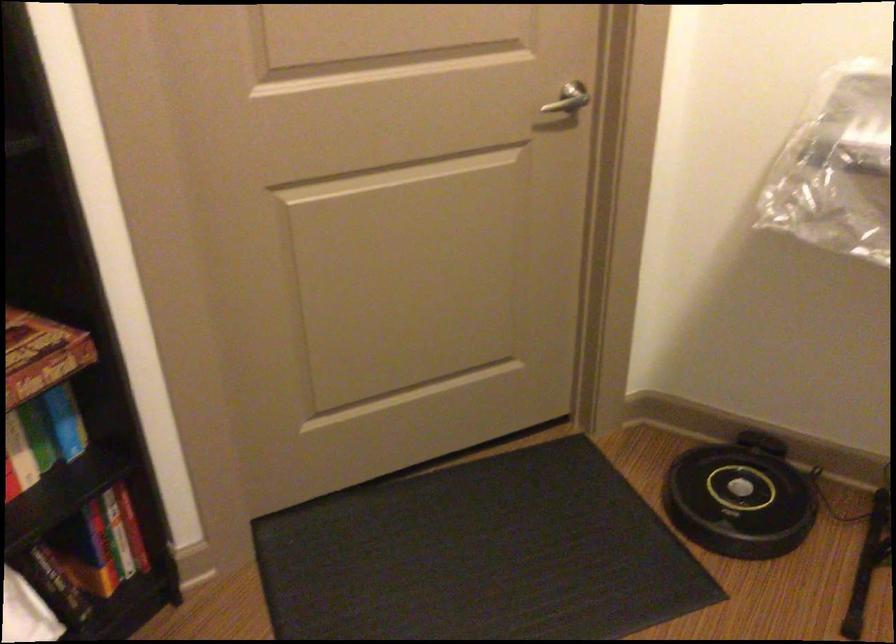
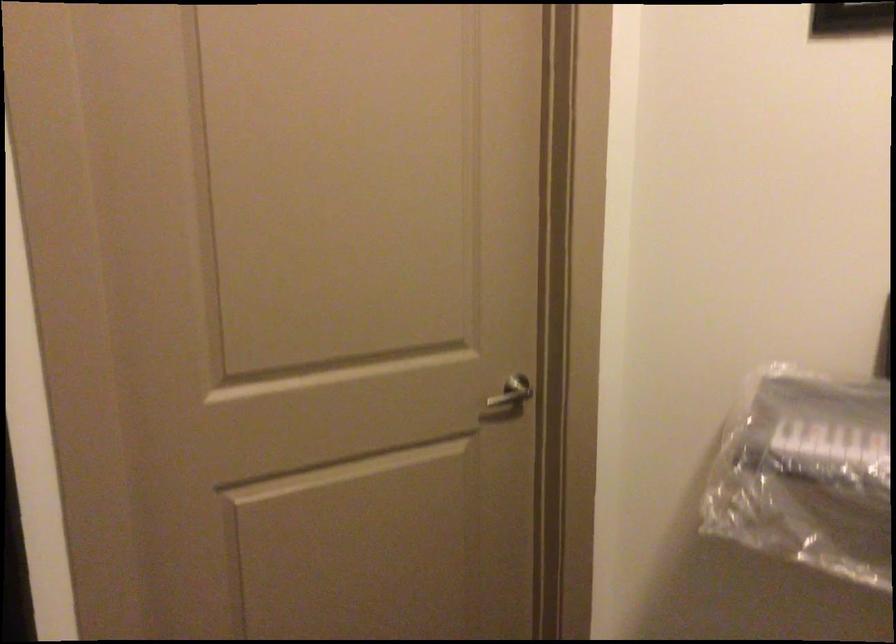
Question: Which direction would the cameraman need to move to produce the second image? Reply with the corresponding letter.

Choices:
 (A) Left
 (B) Right
 (C) Forward
 (D) Backward

Answer: (D)